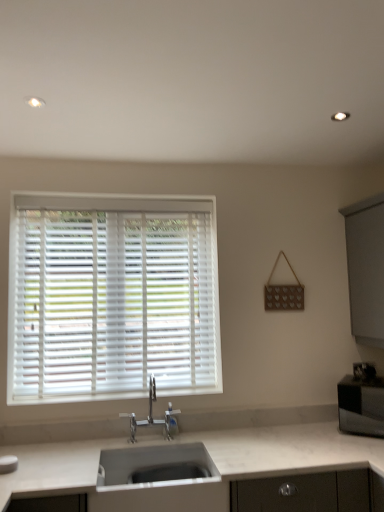
Question: Considering the positions of white plastic blinds at upper left and white marble countertop at lower center in the image, is white plastic blinds at upper left taller or shorter than white marble countertop at lower center?

Choices:
 (A) short
 (B) tall

Answer: (B)

Question: In terms of size, does white plastic blinds at upper left appear bigger or smaller than white marble countertop at lower center?

Choices:
 (A) small
 (B) big

Answer: (A)

Question: Estimate the real-world distances between objects in this image. Which object is closer to the white plastic blinds at upper left?

Choices:
 (A) polished chrome faucet at center
 (B) white matte sink at center
 (C) white marble countertop at lower center
 (D) satin black microwave at right

Answer: (A)

Question: Which object is the farthest from the satin black microwave at right?

Choices:
 (A) polished chrome faucet at center
 (B) white matte sink at center
 (C) white plastic blinds at upper left
 (D) white marble countertop at lower center

Answer: (C)